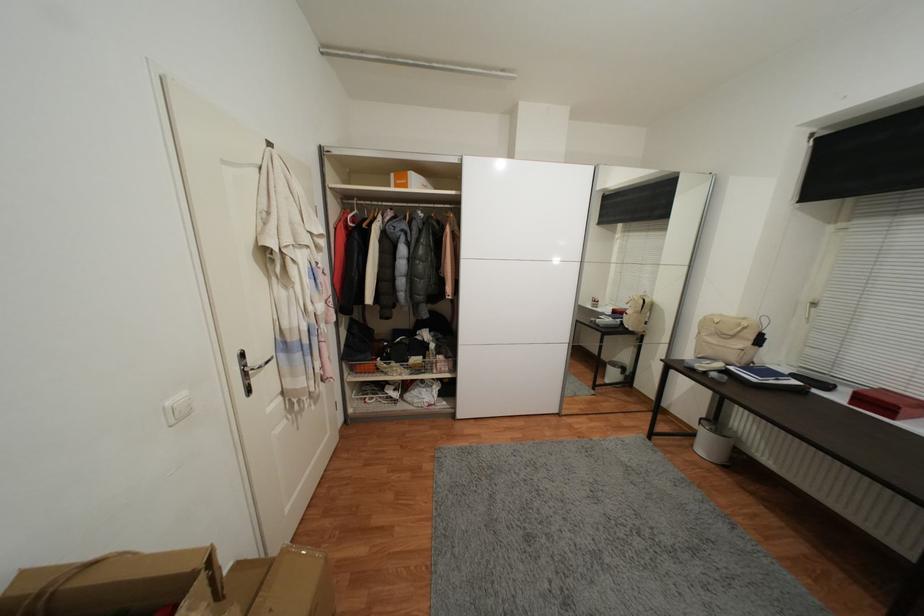
The height and width of the screenshot is (616, 924). Identify the location of white light switch. (177, 408).